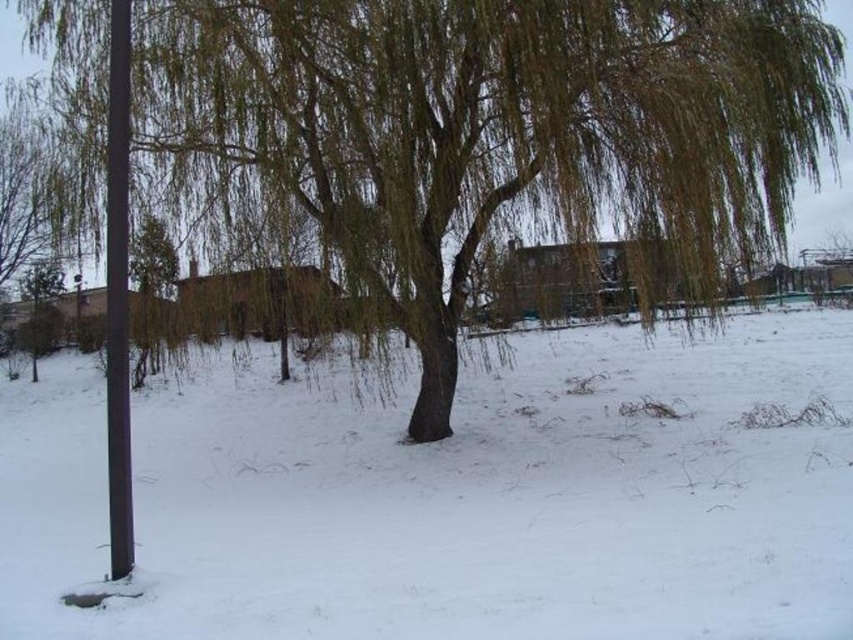
You are standing in the winter scene and want to take a photo of the green leafy tree at center. To avoid including the white fluffy snow at lower left in your photo, should you move to the left or the right of the tree?

The white fluffy snow at lower left is positioned on the right side of the green leafy tree at center. To avoid including it, you should move to the right of the green leafy tree at center so that the snow is out of frame on the left side.